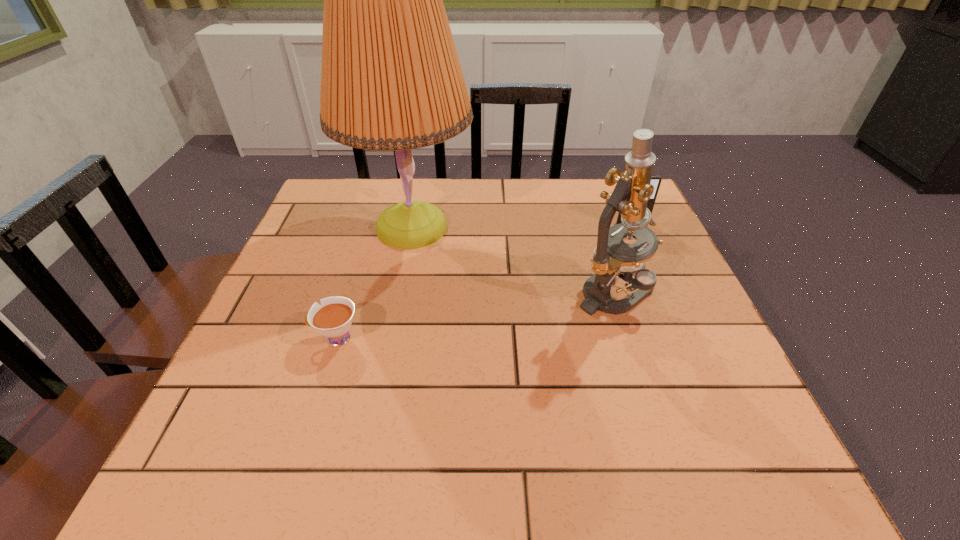
In order to click on free location that satisfies the following two spatial constraints: 1. on the side of the microscope near the pull switch; 2. on the left side of the tallest object in this screenshot , I will do [x=399, y=292].

At what (x,y) coordinates should I click in order to perform the action: click on free space in the image that satisfies the following two spatial constraints: 1. on the side of the lamp near the pull switch; 2. on the back side of the second tallest object. Please return your answer as a coordinate pair (x, y). This screenshot has width=960, height=540. Looking at the image, I should click on (399, 292).